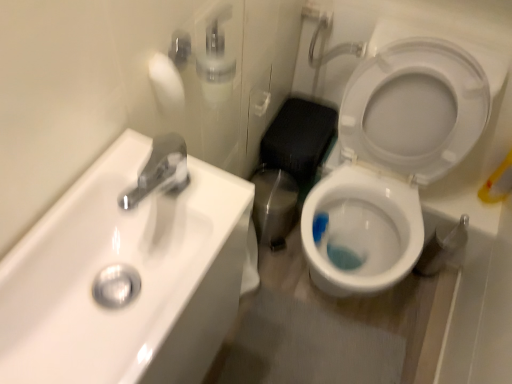
Image resolution: width=512 pixels, height=384 pixels. Describe the element at coordinates (396, 155) in the screenshot. I see `white glossy toilet at right` at that location.

This screenshot has width=512, height=384. I want to click on white glossy toilet at right, so click(396, 155).

What is the approximate width of white glossy sink at upper left?

white glossy sink at upper left is 9.44 inches wide.

The width and height of the screenshot is (512, 384). I want to click on white glossy sink at upper left, so click(x=132, y=266).

Measure the distance between point (127,138) and camera.

They are 64.00 centimeters apart.

The width and height of the screenshot is (512, 384). What do you see at coordinates (132, 266) in the screenshot?
I see `white glossy sink at upper left` at bounding box center [132, 266].

Locate an element on the screen. white glossy toilet at right is located at coordinates (396, 155).

Looking at this image, which object is positioned more to the right, white glossy sink at upper left or white glossy toilet at right?

From the viewer's perspective, white glossy toilet at right appears more on the right side.

Is the depth of white glossy sink at upper left less than that of white glossy toilet at right?

That is True.

Is point (105, 239) more distant than point (410, 206)?

No, it is in front of (410, 206).

From the image's perspective, which one is positioned higher, white glossy sink at upper left or white glossy toilet at right?

From the image's view, white glossy toilet at right is above.

From a real-world perspective, which object stands above the other?

white glossy sink at upper left.

Can you confirm if white glossy sink at upper left is wider than white glossy toilet at right?

Incorrect, the width of white glossy sink at upper left does not surpass that of white glossy toilet at right.

Does white glossy sink at upper left have a lesser height compared to white glossy toilet at right?

Yes.

Considering the relative sizes of white glossy sink at upper left and white glossy toilet at right in the image provided, is white glossy sink at upper left bigger than white glossy toilet at right?

No, white glossy sink at upper left is not bigger than white glossy toilet at right.

Is white glossy toilet at right a part of white glossy sink at upper left?

No, white glossy toilet at right is not inside white glossy sink at upper left.

Is white glossy sink at upper left beside white glossy toilet at right?

There is a gap between white glossy sink at upper left and white glossy toilet at right.

Is white glossy sink at upper left facing away from white glossy toilet at right?

That's not correct — white glossy sink at upper left is not looking away from white glossy toilet at right.

What's the angular difference between white glossy sink at upper left and white glossy toilet at right's facing directions?

They differ by 89.3 degrees in their facing directions.

What are the coordinates of `sink below the white glossy toilet at right (from the image's perspective)` in the screenshot? It's located at click(132, 266).

Between white glossy toilet at right and white glossy sink at upper left, which one appears on the left side from the viewer's perspective?

Positioned to the left is white glossy sink at upper left.

Considering the relative positions of white glossy toilet at right and white glossy sink at upper left in the image provided, is white glossy toilet at right behind white glossy sink at upper left?

Yes, white glossy toilet at right is further from the camera.

Is point (422, 149) farther from camera compared to point (38, 313)?

Yes, point (422, 149) is farther from viewer.

From the image's perspective, is white glossy toilet at right above or below white glossy sink at upper left?

white glossy toilet at right is situated higher than white glossy sink at upper left in the image.

From a real-world perspective, is white glossy toilet at right positioned above or below white glossy sink at upper left?

Clearly, from a real-world perspective, white glossy toilet at right is below white glossy sink at upper left.

Is white glossy toilet at right thinner than white glossy sink at upper left?

Incorrect, the width of white glossy toilet at right is not less than that of white glossy sink at upper left.

Which of these two, white glossy toilet at right or white glossy sink at upper left, stands shorter?

Standing shorter between the two is white glossy sink at upper left.

Can you confirm if white glossy toilet at right is smaller than white glossy sink at upper left?

No, white glossy toilet at right is not smaller than white glossy sink at upper left.

Is white glossy toilet at right inside or outside of white glossy sink at upper left?

white glossy toilet at right is not inside white glossy sink at upper left, it's outside.

Is white glossy toilet at right directly adjacent to white glossy sink at upper left?

There is a gap between white glossy toilet at right and white glossy sink at upper left.

In the scene shown: Could you tell me if white glossy toilet at right is facing white glossy sink at upper left?

No.

Consider the image. What's the angular difference between white glossy toilet at right and white glossy sink at upper left's facing directions?

white glossy toilet at right and white glossy sink at upper left are facing 89.3 degrees away from each other.

Identify the location of toilet located underneath the white glossy sink at upper left (from a real-world perspective). (396, 155).

This screenshot has width=512, height=384. In the image, there is a white glossy toilet at right. In order to click on sink below it (from the image's perspective) in this screenshot , I will do `click(132, 266)`.

You are a GUI agent. You are given a task and a screenshot of the screen. Output one action in this format:
    pyautogui.click(x=<x>, y=<y>)
    Task: Click on the toilet below the white glossy sink at upper left (from a real-world perspective)
    
    Given the screenshot: What is the action you would take?
    pyautogui.click(x=396, y=155)